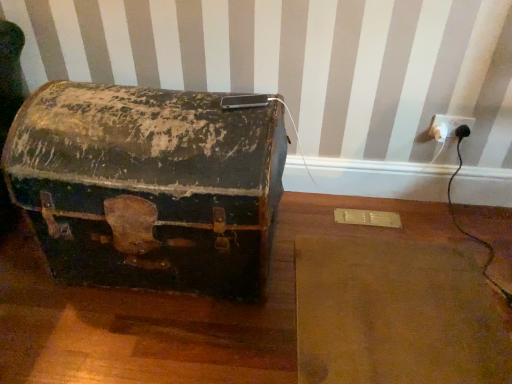
Question: Considering the relative sizes of white plastic outlet at right and rusty metal trunk at center in the image provided, is white plastic outlet at right thinner than rusty metal trunk at center?

Choices:
 (A) yes
 (B) no

Answer: (A)

Question: Considering the relative positions of white plastic outlet at right and rusty metal trunk at center in the image provided, is white plastic outlet at right to the left of rusty metal trunk at center from the viewer's perspective?

Choices:
 (A) no
 (B) yes

Answer: (A)

Question: Is white plastic outlet at right taller than rusty metal trunk at center?

Choices:
 (A) no
 (B) yes

Answer: (A)

Question: Can you confirm if white plastic outlet at right is positioned to the right of rusty metal trunk at center?

Choices:
 (A) no
 (B) yes

Answer: (B)

Question: Is white plastic outlet at right oriented towards rusty metal trunk at center?

Choices:
 (A) no
 (B) yes

Answer: (A)

Question: Considering the relative sizes of white plastic outlet at right and rusty metal trunk at center in the image provided, is white plastic outlet at right bigger than rusty metal trunk at center?

Choices:
 (A) no
 (B) yes

Answer: (A)

Question: From a real-world perspective, is rusty metal trunk at center physically above white plastic outlet at right?

Choices:
 (A) yes
 (B) no

Answer: (B)

Question: Is the position of rusty metal trunk at center more distant than that of white plastic outlet at right?

Choices:
 (A) no
 (B) yes

Answer: (A)

Question: Considering the relative sizes of rusty metal trunk at center and white plastic outlet at right in the image provided, is rusty metal trunk at center shorter than white plastic outlet at right?

Choices:
 (A) yes
 (B) no

Answer: (B)

Question: Is rusty metal trunk at center to the right of white plastic outlet at right from the viewer's perspective?

Choices:
 (A) yes
 (B) no

Answer: (B)

Question: Is rusty metal trunk at center facing towards white plastic outlet at right?

Choices:
 (A) yes
 (B) no

Answer: (B)

Question: Is rusty metal trunk at center turned away from white plastic outlet at right?

Choices:
 (A) no
 (B) yes

Answer: (A)

Question: In terms of size, does white plastic outlet at right appear bigger or smaller than rusty metal trunk at center?

Choices:
 (A) big
 (B) small

Answer: (B)